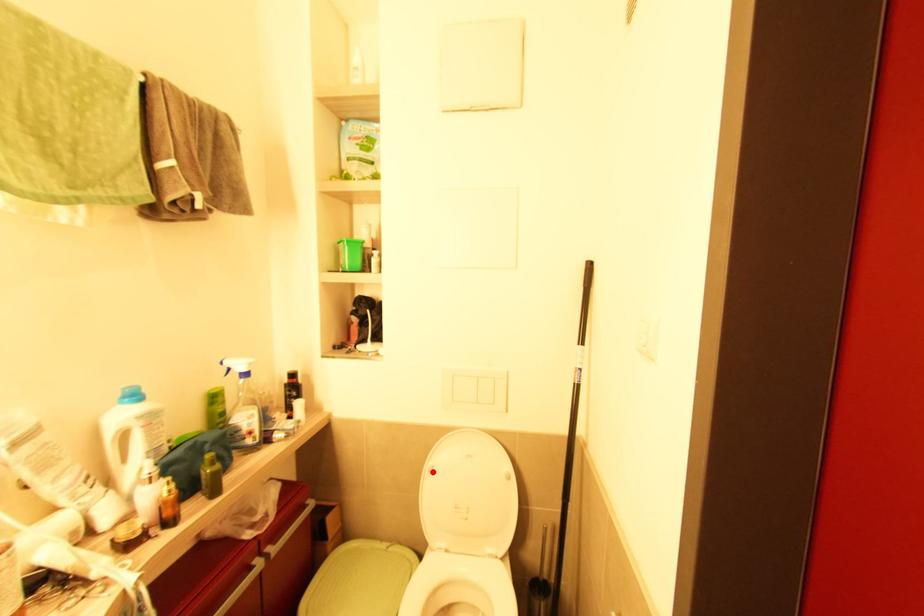
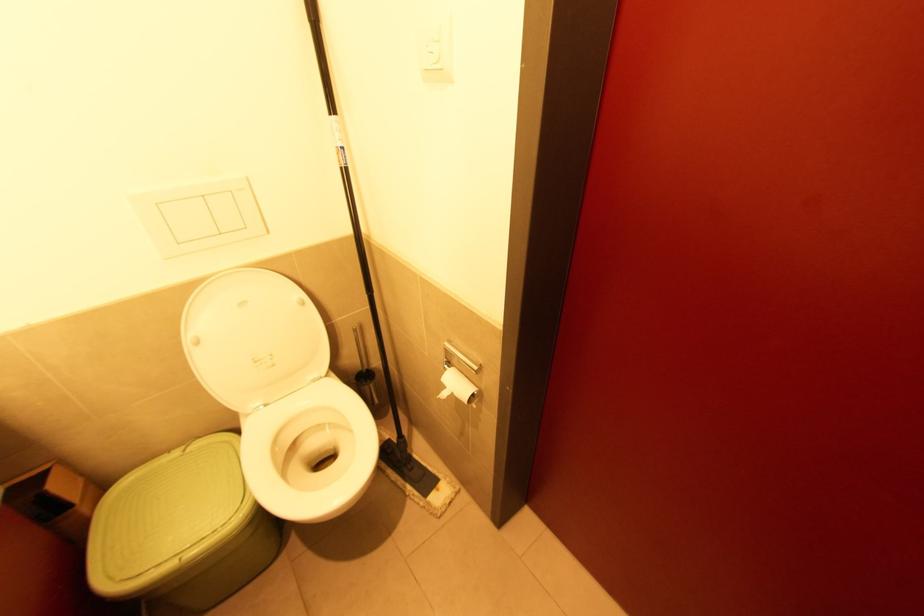
Locate, in the second image, the point that corresponds to the highlighted location in the first image.

(200, 342)